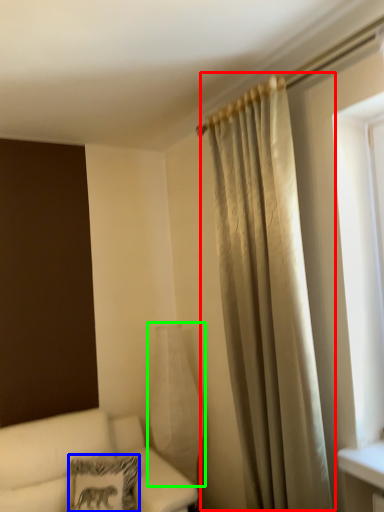
Question: Based on their relative distances, which object is nearer to curtain (highlighted by a red box)? Choose from pillow (highlighted by a blue box) and glass vase (highlighted by a green box).

Choices:
 (A) pillow
 (B) glass vase

Answer: (B)